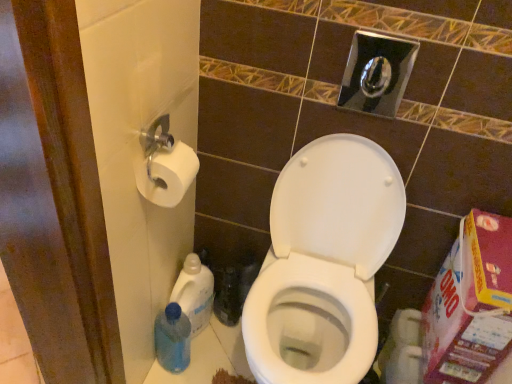
Find the location of a particular element. translucent plastic bottle at lower left, positioned as the first cleaning product in top-to-bottom order is located at coordinates pos(194,293).

Describe the element at coordinates (166, 174) in the screenshot. I see `white matte toilet paper at left` at that location.

What do you see at coordinates (172, 338) in the screenshot? The image size is (512, 384). I see `blue plastic bottle at lower left, acting as the 1th cleaning product starting from the bottom` at bounding box center [172, 338].

This screenshot has width=512, height=384. I want to click on translucent plastic bottle at lower left, positioned as the first cleaning product in top-to-bottom order, so pyautogui.click(x=194, y=293).

Is white glossy toilet at center not close to white matte toilet paper at left?

No, white glossy toilet at center is not far away from white matte toilet paper at left.

Does white glossy toilet at center appear on the right side of white matte toilet paper at left?

Yes.

From the image's perspective, is white glossy toilet at center below white matte toilet paper at left?

Indeed, from the image's perspective, white glossy toilet at center is shown beneath white matte toilet paper at left.

From a real-world perspective, is white glossy toilet at center physically below white matte toilet paper at left?

Yes, from a real-world perspective, white glossy toilet at center is below white matte toilet paper at left.

Based on the photo, from a real-world perspective, relative to white matte toilet paper at left, is translucent plastic bottle at lower left, positioned as the first cleaning product in top-to-bottom order, vertically above or below?

Clearly, from a real-world perspective, translucent plastic bottle at lower left, positioned as the first cleaning product in top-to-bottom order, is below white matte toilet paper at left.

Looking at this image, considering the relative positions of translucent plastic bottle at lower left, positioned as the first cleaning product in top-to-bottom order, and white matte toilet paper at left in the image provided, is translucent plastic bottle at lower left, positioned as the first cleaning product in top-to-bottom order, to the right of white matte toilet paper at left from the viewer's perspective?

No, translucent plastic bottle at lower left, positioned as the first cleaning product in top-to-bottom order, is not to the right of white matte toilet paper at left.

How far apart are translucent plastic bottle at lower left, positioned as the first cleaning product in top-to-bottom order, and white matte toilet paper at left?

translucent plastic bottle at lower left, positioned as the first cleaning product in top-to-bottom order, and white matte toilet paper at left are 21.84 inches apart.

Which of these two, translucent plastic bottle at lower left, acting as the second cleaning product starting from the bottom, or white matte toilet paper at left, is wider?

Wider between the two is translucent plastic bottle at lower left, acting as the second cleaning product starting from the bottom.

Is translucent plastic bottle at lower left, positioned as the first cleaning product in top-to-bottom order, aimed at blue plastic bottle at lower left, acting as the 1th cleaning product starting from the bottom?

No.

Find the location of `cleaning product above the blue plastic bottle at lower left, acting as the 1th cleaning product starting from the bottom (from a real-world perspective)`. cleaning product above the blue plastic bottle at lower left, acting as the 1th cleaning product starting from the bottom (from a real-world perspective) is located at coordinates (194, 293).

Between point (208, 311) and point (188, 330), which one is positioned behind?

Point (208, 311)

Which cleaning product is the 1st one when counting from the back of the white glossy toilet at center? Please provide its 2D coordinates.

[(172, 338)]

Considering the relative positions of blue plastic bottle at lower left, acting as the 1th cleaning product starting from the bottom, and white glossy toilet at center in the image provided, is blue plastic bottle at lower left, acting as the 1th cleaning product starting from the bottom, to the left or to the right of white glossy toilet at center?

Clearly, blue plastic bottle at lower left, acting as the 1th cleaning product starting from the bottom, is on the left of white glossy toilet at center in the image.

Considering the relative sizes of blue plastic bottle at lower left, acting as the 1th cleaning product starting from the bottom, and white glossy toilet at center in the image provided, is blue plastic bottle at lower left, acting as the 1th cleaning product starting from the bottom, wider than white glossy toilet at center?

In fact, blue plastic bottle at lower left, acting as the 1th cleaning product starting from the bottom, might be narrower than white glossy toilet at center.

Between blue plastic bottle at lower left, which ranks as the 2th cleaning product in top-to-bottom order, and white glossy toilet at center, which one has less height?

blue plastic bottle at lower left, which ranks as the 2th cleaning product in top-to-bottom order, is shorter.

Which of these two, white glossy toilet at center or blue plastic bottle at lower left, which ranks as the 2th cleaning product in top-to-bottom order, is wider?

Wider between the two is white glossy toilet at center.

Is white glossy toilet at center located outside blue plastic bottle at lower left, acting as the 1th cleaning product starting from the bottom?

Yes, white glossy toilet at center is located beyond the bounds of blue plastic bottle at lower left, acting as the 1th cleaning product starting from the bottom.

Can you see white glossy toilet at center touching blue plastic bottle at lower left, which ranks as the 2th cleaning product in top-to-bottom order?

No, white glossy toilet at center is not making contact with blue plastic bottle at lower left, which ranks as the 2th cleaning product in top-to-bottom order.

Is white glossy toilet at center at the right side of translucent plastic bottle at lower left, acting as the second cleaning product starting from the bottom?

Indeed, white glossy toilet at center is positioned on the right side of translucent plastic bottle at lower left, acting as the second cleaning product starting from the bottom.

In order to click on the 1st cleaning product to the left of the white glossy toilet at center, counting from the anchor's position in this screenshot , I will do `click(194, 293)`.

Is white glossy toilet at center with translucent plastic bottle at lower left, positioned as the first cleaning product in top-to-bottom order?

No, white glossy toilet at center is not making contact with translucent plastic bottle at lower left, positioned as the first cleaning product in top-to-bottom order.

Is point (159, 197) behind point (208, 299)?

That is False.

Is white matte toilet paper at left behind translucent plastic bottle at lower left, positioned as the first cleaning product in top-to-bottom order?

No, white matte toilet paper at left is closer to the viewer.

Considering the sizes of objects white matte toilet paper at left and translucent plastic bottle at lower left, acting as the second cleaning product starting from the bottom, in the image provided, who is thinner, white matte toilet paper at left or translucent plastic bottle at lower left, acting as the second cleaning product starting from the bottom,?

With smaller width is white matte toilet paper at left.

Locate an element on the screen. This screenshot has height=384, width=512. toilet paper on the right of translucent plastic bottle at lower left, acting as the second cleaning product starting from the bottom is located at coordinates (166, 174).

Identify the location of toilet paper that appears on the left of white glossy toilet at center. This screenshot has width=512, height=384. (166, 174).

The height and width of the screenshot is (384, 512). Find the location of `cleaning product that is the 2nd object located behind the white matte toilet paper at left`. cleaning product that is the 2nd object located behind the white matte toilet paper at left is located at coordinates (194, 293).

When comparing their distances from white glossy toilet at center, does translucent plastic bottle at lower left, acting as the second cleaning product starting from the bottom, or white matte toilet paper at left seem further?

white matte toilet paper at left is positioned further to the anchor white glossy toilet at center.

Considering their positions, is blue plastic bottle at lower left, acting as the 1th cleaning product starting from the bottom, positioned further to white glossy toilet at center than white matte toilet paper at left?

white matte toilet paper at left.

When comparing their distances from white matte toilet paper at left, does blue plastic bottle at lower left, acting as the 1th cleaning product starting from the bottom, or translucent plastic bottle at lower left, positioned as the first cleaning product in top-to-bottom order, seem further?

Among the two, blue plastic bottle at lower left, acting as the 1th cleaning product starting from the bottom, is located further to white matte toilet paper at left.

Estimate the real-world distances between objects in this image. Which object is closer to white matte toilet paper at left, white glossy toilet at center or blue plastic bottle at lower left, which ranks as the 2th cleaning product in top-to-bottom order?

Based on the image, white glossy toilet at center appears to be nearer to white matte toilet paper at left.

Which object lies nearer to the anchor point translucent plastic bottle at lower left, acting as the second cleaning product starting from the bottom, white matte toilet paper at left or blue plastic bottle at lower left, which ranks as the 2th cleaning product in top-to-bottom order?

blue plastic bottle at lower left, which ranks as the 2th cleaning product in top-to-bottom order, lies closer to translucent plastic bottle at lower left, acting as the second cleaning product starting from the bottom, than the other object.

Estimate the real-world distances between objects in this image. Which object is further from translucent plastic bottle at lower left, positioned as the first cleaning product in top-to-bottom order, blue plastic bottle at lower left, which ranks as the 2th cleaning product in top-to-bottom order, or white matte toilet paper at left?

white matte toilet paper at left is positioned further to the anchor translucent plastic bottle at lower left, positioned as the first cleaning product in top-to-bottom order.

When comparing their distances from blue plastic bottle at lower left, which ranks as the 2th cleaning product in top-to-bottom order, does translucent plastic bottle at lower left, acting as the second cleaning product starting from the bottom, or white matte toilet paper at left seem closer?

translucent plastic bottle at lower left, acting as the second cleaning product starting from the bottom, is closer to blue plastic bottle at lower left, which ranks as the 2th cleaning product in top-to-bottom order.

When comparing their distances from translucent plastic bottle at lower left, positioned as the first cleaning product in top-to-bottom order, does blue plastic bottle at lower left, which ranks as the 2th cleaning product in top-to-bottom order, or white glossy toilet at center seem closer?

blue plastic bottle at lower left, which ranks as the 2th cleaning product in top-to-bottom order, lies closer to translucent plastic bottle at lower left, positioned as the first cleaning product in top-to-bottom order, than the other object.

Identify the location of toilet paper between white glossy toilet at center and blue plastic bottle at lower left, which ranks as the 2th cleaning product in top-to-bottom order, in the front-back direction. The image size is (512, 384). (166, 174).

Identify the location of toilet paper between white glossy toilet at center and translucent plastic bottle at lower left, acting as the second cleaning product starting from the bottom, from front to back. The width and height of the screenshot is (512, 384). (166, 174).

This screenshot has width=512, height=384. Identify the location of cleaning product between white matte toilet paper at left and blue plastic bottle at lower left, which ranks as the 2th cleaning product in top-to-bottom order, in the vertical direction. (194, 293).

Where is `cleaning product positioned between white glossy toilet at center and translucent plastic bottle at lower left, acting as the second cleaning product starting from the bottom, from near to far`? This screenshot has width=512, height=384. cleaning product positioned between white glossy toilet at center and translucent plastic bottle at lower left, acting as the second cleaning product starting from the bottom, from near to far is located at coordinates (172, 338).